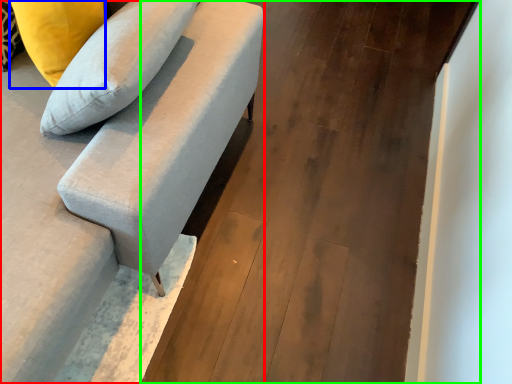
Question: Estimate the real-world distances between objects in this image. Which object is closer to studio couch (highlighted by a red box), pillow (highlighted by a blue box) or concrete (highlighted by a green box)?

Choices:
 (A) pillow
 (B) concrete

Answer: (A)